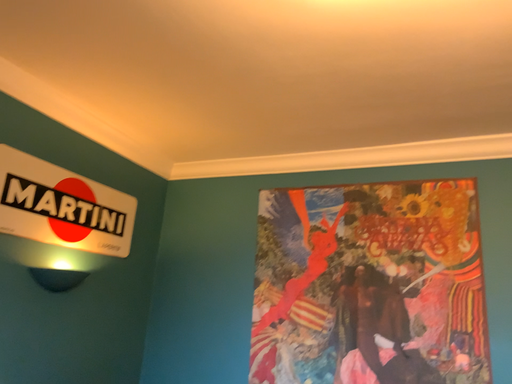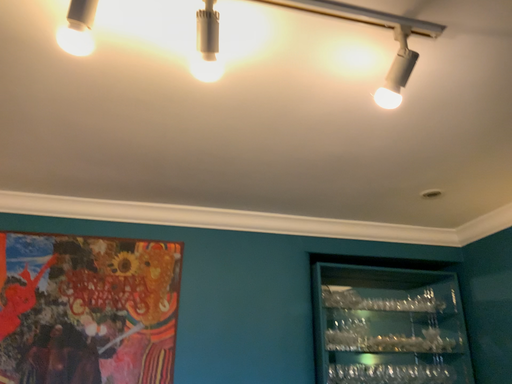
Question: Which way did the camera rotate in the video?

Choices:
 (A) rotated left
 (B) rotated right

Answer: (B)